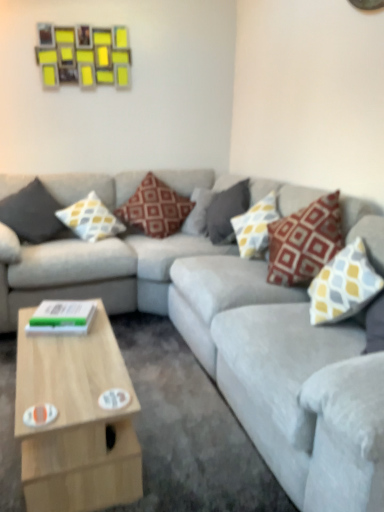
Question: From a real-world perspective, does gray fabric pillow at center, the third pillow when ordered from right to left, stand above yellow and gray patterned pillow at upper right, which is the 6th pillow from left to right?

Choices:
 (A) no
 (B) yes

Answer: (B)

Question: Does gray fabric pillow at center, which is the fourth pillow from left to right, turn towards yellow and gray patterned pillow at upper right, which is the first pillow in right-to-left order?

Choices:
 (A) yes
 (B) no

Answer: (B)

Question: Is gray fabric pillow at center, which is the fourth pillow from left to right, positioned before yellow and gray patterned pillow at upper right, which is the 6th pillow from left to right?

Choices:
 (A) yes
 (B) no

Answer: (B)

Question: Is gray fabric pillow at center, the third pillow when ordered from right to left, far away from yellow and gray patterned pillow at upper right, which is the first pillow in right-to-left order?

Choices:
 (A) yes
 (B) no

Answer: (A)

Question: From the image's perspective, is gray fabric pillow at center, the third pillow when ordered from right to left, located above yellow and gray patterned pillow at upper right, which is the first pillow in right-to-left order?

Choices:
 (A) no
 (B) yes

Answer: (B)

Question: Which is correct: light wood coffee table at lower left is inside yellow-gray patterned pillow at center, arranged as the 5th pillow when viewed from the left, or outside of it?

Choices:
 (A) inside
 (B) outside

Answer: (B)

Question: Is point (46, 394) closer or farther from the camera than point (240, 224)?

Choices:
 (A) farther
 (B) closer

Answer: (B)

Question: Looking at the image, does light wood coffee table at lower left seem bigger or smaller compared to yellow-gray patterned pillow at center, arranged as the 5th pillow when viewed from the left?

Choices:
 (A) small
 (B) big

Answer: (B)

Question: Based on their positions, is light wood coffee table at lower left located to the left or right of yellow-gray patterned pillow at center, which ranks as the second pillow in right-to-left order?

Choices:
 (A) right
 (B) left

Answer: (B)

Question: Does point (29, 374) appear closer or farther from the camera than point (241, 211)?

Choices:
 (A) farther
 (B) closer

Answer: (B)

Question: In the image, is light wood coffee table at lower left positioned in front of or behind gray fabric pillow at center, which is the fourth pillow from left to right?

Choices:
 (A) behind
 (B) front

Answer: (B)

Question: From a real-world perspective, is light wood coffee table at lower left positioned above or below gray fabric pillow at center, the third pillow when ordered from right to left?

Choices:
 (A) below
 (B) above

Answer: (A)

Question: Is light wood coffee table at lower left wider or thinner than gray fabric pillow at center, the third pillow when ordered from right to left?

Choices:
 (A) thin
 (B) wide

Answer: (B)

Question: Considering the positions of light wood coffee table at lower left and brown textured pillow at center, the 4th pillow positioned from the right, in the image, is light wood coffee table at lower left wider or thinner than brown textured pillow at center, the 4th pillow positioned from the right,?

Choices:
 (A) wide
 (B) thin

Answer: (B)

Question: In the image, is light wood coffee table at lower left on the left side or the right side of brown textured pillow at center, which is the 3th pillow from left to right?

Choices:
 (A) right
 (B) left

Answer: (B)